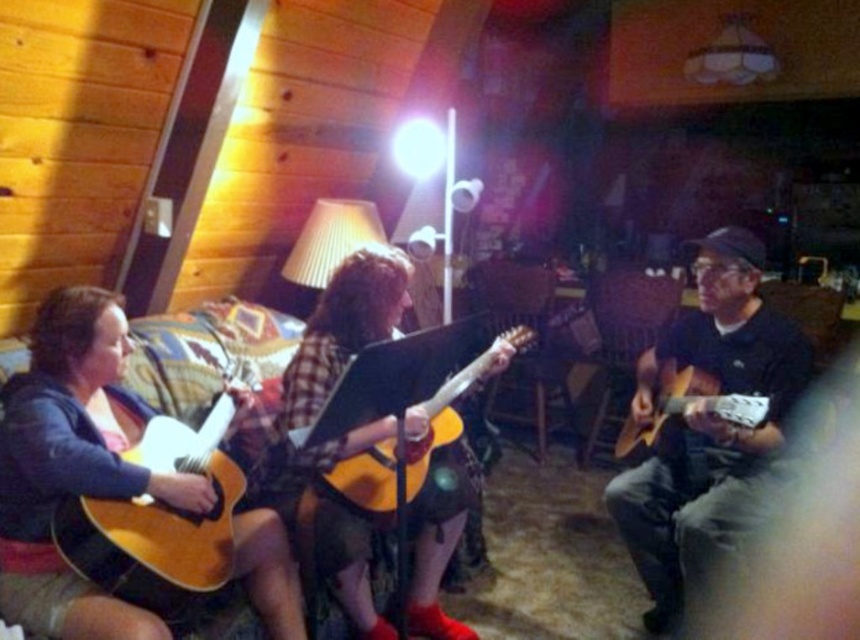
Between matte black guitar at center and matte wood guitar at left, which one is positioned lower?

matte wood guitar at left is lower down.

The height and width of the screenshot is (640, 860). I want to click on matte black guitar at center, so click(x=705, y=422).

Who is more distant from viewer, (172, 529) or (345, 481)?

Positioned behind is point (345, 481).

From the picture: Which is below, matte wood guitar at left or acoustic wood guitar at center?

matte wood guitar at left

Measure the distance between matte wood guitar at left and camera.

matte wood guitar at left is 5.81 feet away from camera.

Where is `matte wood guitar at left`? This screenshot has height=640, width=860. matte wood guitar at left is located at coordinates (158, 518).

Who is lower down, matte black guitar at center or matte acoustic guitar at right?

Positioned lower is matte black guitar at center.

Is point (726, 424) farther from camera compared to point (679, 388)?

No, it is not.

Identify the location of matte black guitar at center. click(x=705, y=422).